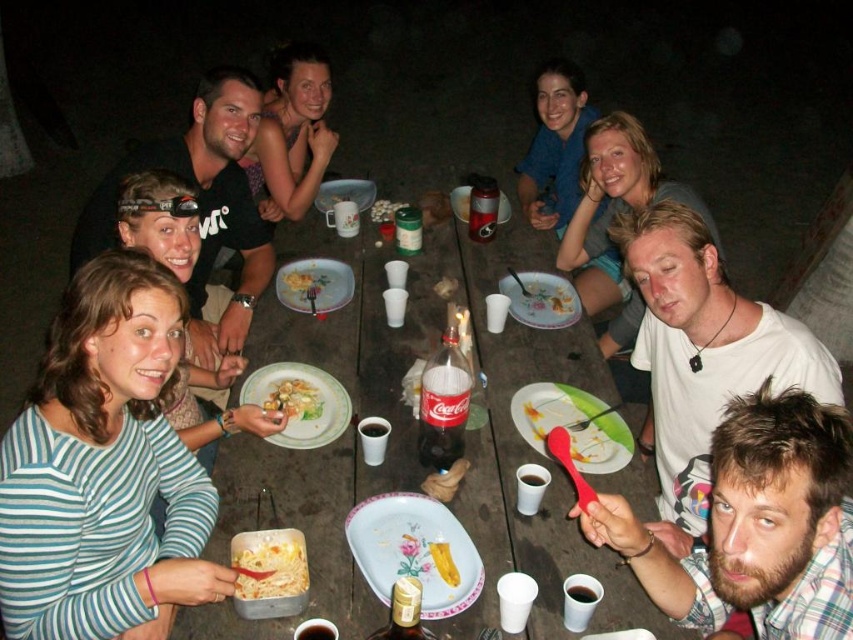
Looking at this image, you are standing at the edge of the picnic table and want to place a napkin exactly where the porcelain plate at center was located. According to the coordinates provided, where should you place the napkin?

You should place the napkin at the coordinates point (345,193) where the porcelain plate at center was located.

You are a guest at this picnic table and want to grab the yellow matte pasta at center. However, there is a porcelain plate at center in the way. Can you easily access the pasta without moving the plate?

The porcelain plate at center is positioned over yellow matte pasta at center, so you cannot easily access the pasta without moving the plate.